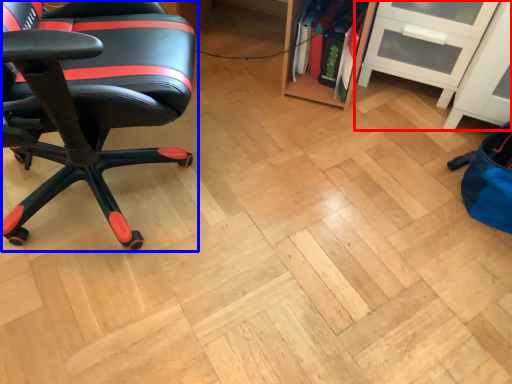
Question: Which of the following is the closest to the observer, shelf (highlighted by a red box) or chair (highlighted by a blue box)?

Choices:
 (A) shelf
 (B) chair

Answer: (B)